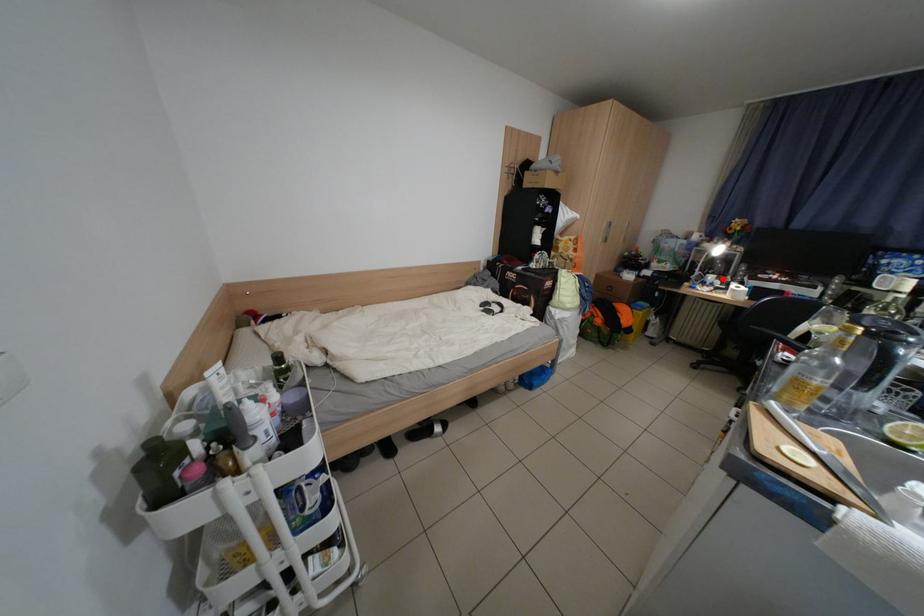
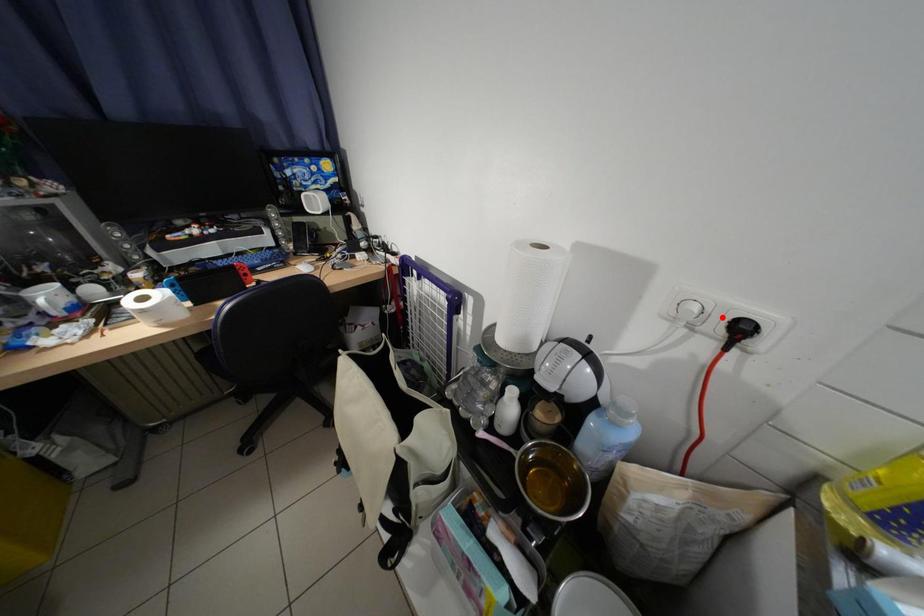
I am providing you with two images of the same scene from different viewpoints. A red point is marked on the first image and another point is marked on the second image. Does the point marked in image1 correspond to the same location as the one in image2?

No